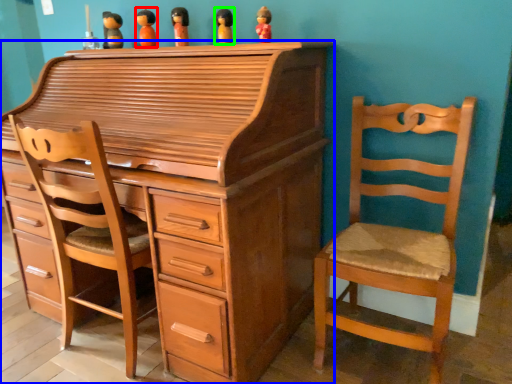
Question: Which object is positioned farthest from toy (highlighted by a red box)? Select from chest of drawers (highlighted by a blue box) and toy (highlighted by a green box).

Choices:
 (A) chest of drawers
 (B) toy

Answer: (A)